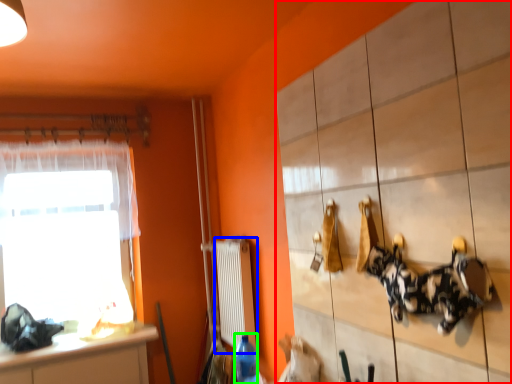
Question: Estimate the real-world distances between objects in this image. Which object is farther from cabinetry (highlighted by a red box), radiator (highlighted by a blue box) or bottle (highlighted by a green box)?

Choices:
 (A) radiator
 (B) bottle

Answer: (A)